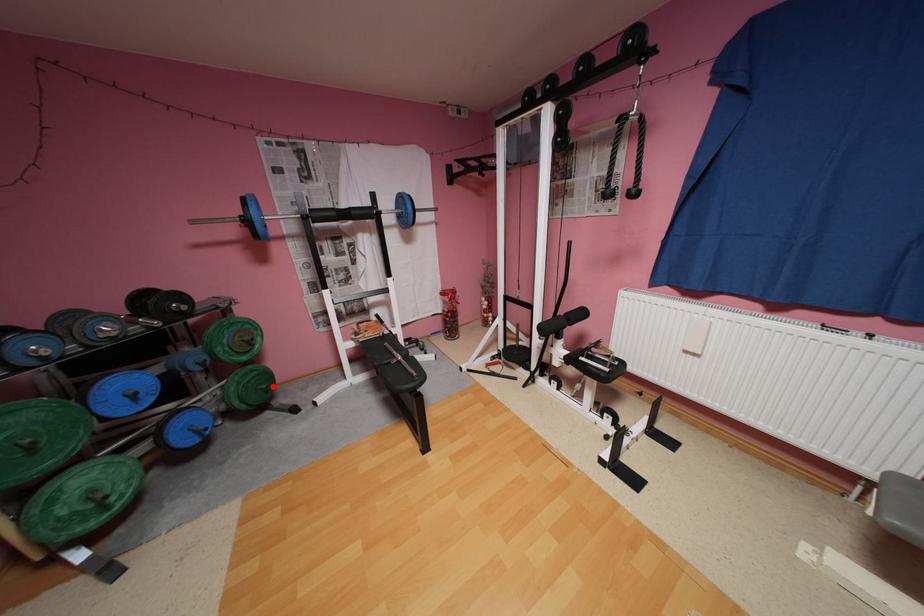
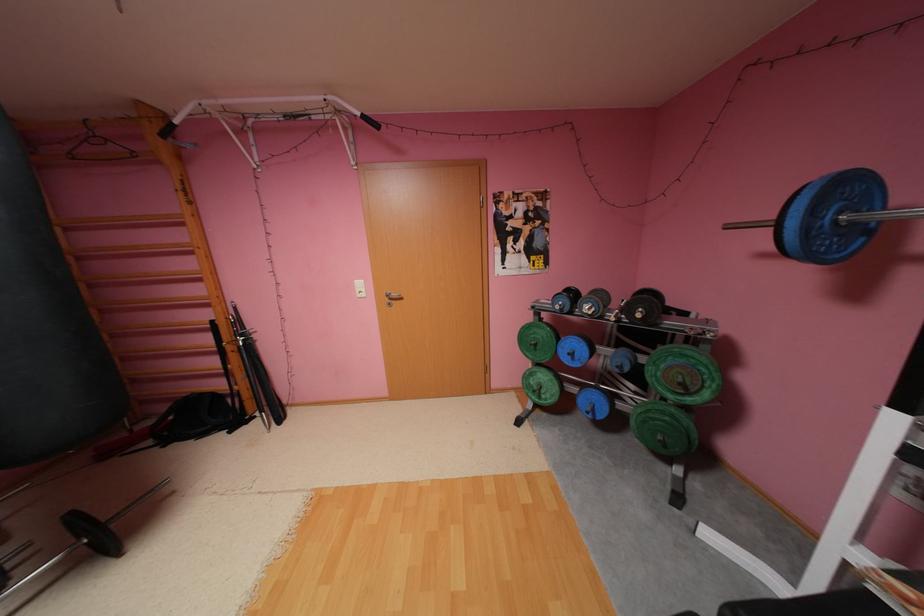
Question: I am providing you with two images of the same scene from different viewpoints. Image1 has a red point marked. In image2, the corresponding 3D location appears at what relative position? Reply with the corresponding letter.

Choices:
 (A) Closer
 (B) Farther

Answer: (B)